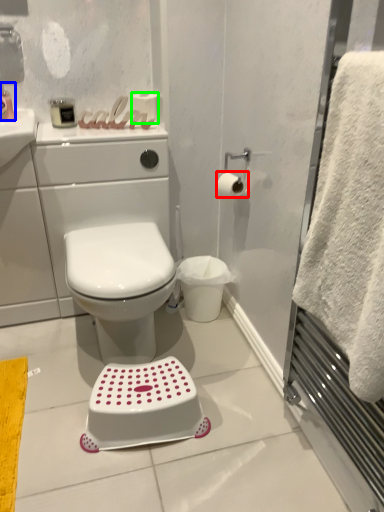
Question: Considering the real-world distances, which object is closest to toilet paper (highlighted by a red box)? toiletry (highlighted by a blue box) or toilet paper (highlighted by a green box).

Choices:
 (A) toiletry
 (B) toilet paper

Answer: (B)